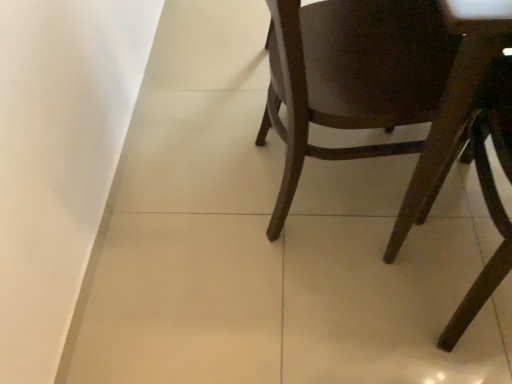
Question: Is dark wood chair at lower right, the 1th chair viewed from the right, wider or thinner than dark wood chair at right, which is the first chair in left-to-right order?

Choices:
 (A) wide
 (B) thin

Answer: (B)

Question: From the image's perspective, is dark wood chair at lower right, the 1th chair viewed from the right, above or below dark wood chair at right, which is the first chair in left-to-right order?

Choices:
 (A) below
 (B) above

Answer: (A)

Question: Relative to dark wood chair at right, acting as the second chair starting from the right, is dark wood chair at lower right, the 2th chair in the left-to-right sequence, in front or behind?

Choices:
 (A) front
 (B) behind

Answer: (A)

Question: Looking at their shapes, would you say dark wood chair at right, acting as the second chair starting from the right, is wider or thinner than dark wood chair at lower right, the 1th chair viewed from the right?

Choices:
 (A) thin
 (B) wide

Answer: (B)

Question: Would you say dark wood chair at right, which is the first chair in left-to-right order, is to the left or to the right of dark wood chair at lower right, the 1th chair viewed from the right, in the picture?

Choices:
 (A) left
 (B) right

Answer: (A)

Question: Considering the positions of dark wood chair at right, acting as the second chair starting from the right, and dark wood chair at lower right, the 1th chair viewed from the right, in the image, is dark wood chair at right, acting as the second chair starting from the right, taller or shorter than dark wood chair at lower right, the 1th chair viewed from the right,?

Choices:
 (A) tall
 (B) short

Answer: (A)

Question: From a real-world perspective, is dark wood chair at right, acting as the second chair starting from the right, physically located above or below dark wood chair at lower right, the 1th chair viewed from the right?

Choices:
 (A) below
 (B) above

Answer: (B)